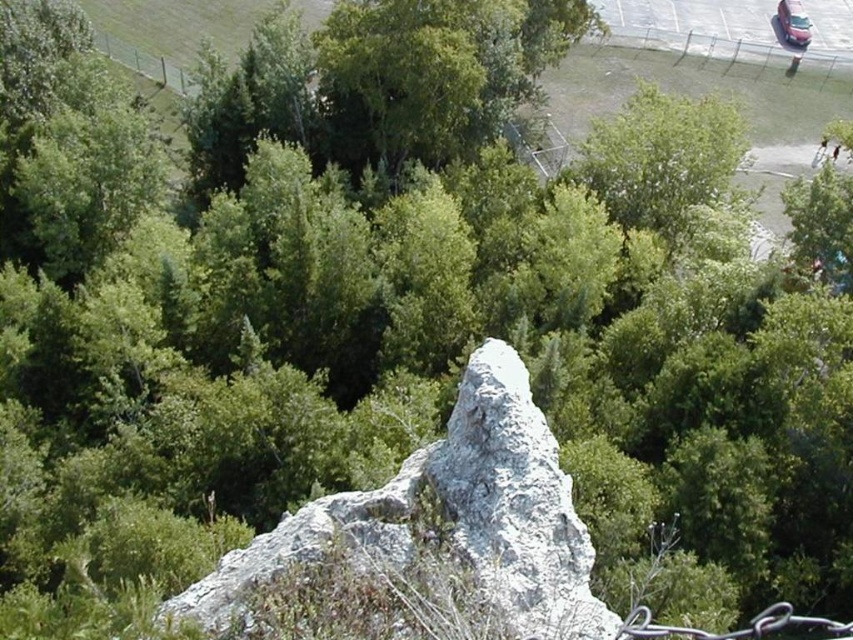
You are standing in a forest and see two points marked in the image. The first point is at coordinates point (495,467) and the second is at point (802,17). Which point is closer to you?

Point (495,467) is closer to the camera than point (802,17).

Consider the image. You are a hiker who wants to take a photo of the metallic silver car at upper right. To get a clear shot, you need to position yourself so that the white rough rock at center doesn

The white rough rock at center occupies less space than the metallic silver car at upper right, so positioning yourself to avoid the rock will allow you to capture the car in the frame without obstruction.